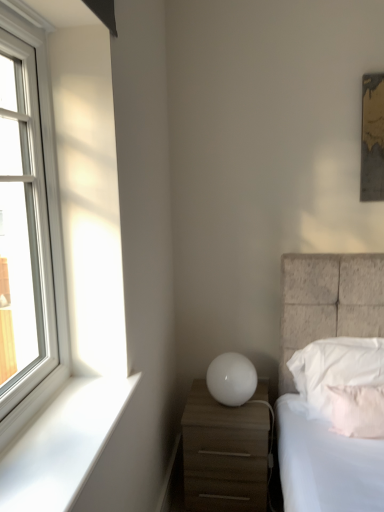
In order to click on free space in front of white glossy sphere at center in this screenshot , I will do `click(231, 420)`.